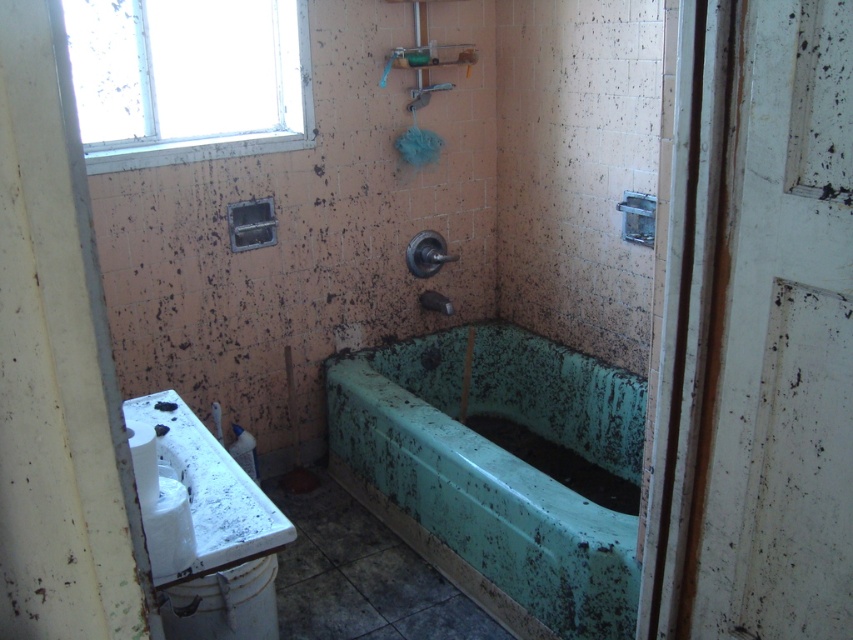
Question: Is green painted bathtub at center bigger than white glossy toilet bowl at lower left?

Choices:
 (A) yes
 (B) no

Answer: (A)

Question: Where is white matte sink at lower left located in relation to white glossy toilet bowl at lower left in the image?

Choices:
 (A) right
 (B) left

Answer: (B)

Question: Which of the following is the closest to the observer?

Choices:
 (A) white plastic window at upper left
 (B) white glossy toilet bowl at lower left

Answer: (B)

Question: Where is white plastic window at upper left located in relation to white glossy toilet bowl at lower left in the image?

Choices:
 (A) right
 (B) left

Answer: (B)

Question: Which of the following is the farthest from the observer?

Choices:
 (A) (234, 484)
 (B) (260, 609)
 (C) (352, 460)

Answer: (C)

Question: Which of these objects is positioned farthest from the white plastic window at upper left?

Choices:
 (A) white glossy toilet bowl at lower left
 (B) white matte sink at lower left
 (C) green painted bathtub at center

Answer: (A)